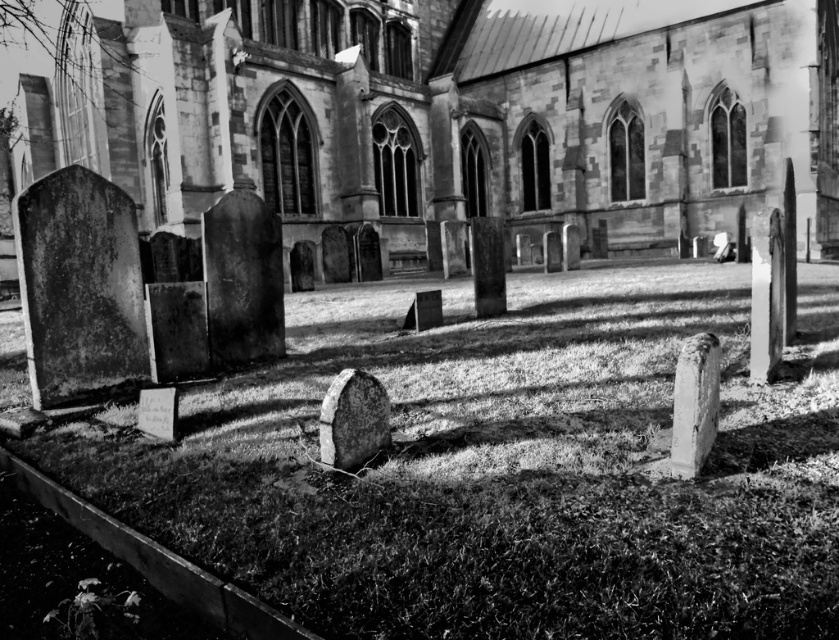
Question: Is smooth stone church at center above smooth stone gravestone at lower right?

Choices:
 (A) yes
 (B) no

Answer: (A)

Question: Which point is farther to the camera?

Choices:
 (A) (679, 417)
 (B) (660, 61)

Answer: (B)

Question: Among these objects, which one is nearest to the camera?

Choices:
 (A) smooth stone church at center
 (B) rough stone gravestone at center
 (C) smooth stone gravestone at lower right

Answer: (C)

Question: Which point is closer to the camera?

Choices:
 (A) smooth stone gravestone at lower right
 (B) smooth stone church at center
 (C) rough stone gravestone at center

Answer: (A)

Question: In this image, where is smooth stone church at center located relative to smooth stone gravestone at lower right?

Choices:
 (A) above
 (B) below

Answer: (A)

Question: Is smooth stone gravestone at lower right wider than rough stone gravestone at center?

Choices:
 (A) yes
 (B) no

Answer: (B)